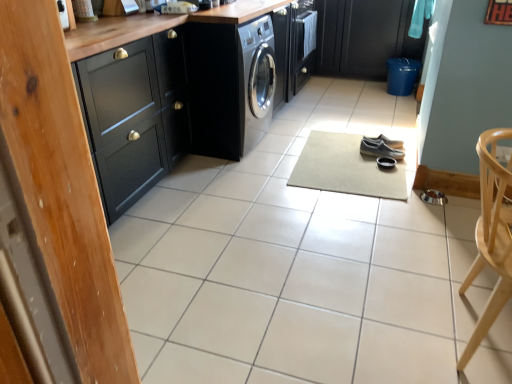
Where is `dark grey canvas shoes at center, the second footwear when ordered from back to front`? The image size is (512, 384). dark grey canvas shoes at center, the second footwear when ordered from back to front is located at coordinates (380, 149).

Measure the distance between dark grey canvas shoes at center, the second footwear when ordered from back to front, and camera.

2.82 meters.

How much space does black matte cabinet at left, which ranks as the 2th cabinetry in top-to-bottom order, occupy vertically?

It is 35.49 inches.

The height and width of the screenshot is (384, 512). What do you see at coordinates (345, 168) in the screenshot?
I see `beige carpet at center` at bounding box center [345, 168].

Locate an element on the screen. black matte cabinet at upper right, which is the 1th cabinetry from right to left is located at coordinates (364, 37).

Considering the relative sizes of black matte cabinet at left, which ranks as the 2th cabinetry in top-to-bottom order, and black leather shoes at center, which is counted as the 2th footwear, starting from the front, in the image provided, is black matte cabinet at left, which ranks as the 2th cabinetry in top-to-bottom order, bigger than black leather shoes at center, which is counted as the 2th footwear, starting from the front,?

Yes, black matte cabinet at left, which ranks as the 2th cabinetry in top-to-bottom order, is bigger than black leather shoes at center, which is counted as the 2th footwear, starting from the front.

From the image's perspective, which one is positioned higher, black matte cabinet at left, positioned as the second cabinetry in right-to-left order, or black leather shoes at center, which is counted as the 2th footwear, starting from the front?

black matte cabinet at left, positioned as the second cabinetry in right-to-left order, is shown above in the image.

Is point (139, 134) farther from viewer compared to point (362, 136)?

No, it is not.

Who is taller, black matte cabinet at left, which is the first cabinetry in bottom-to-top order, or black leather shoes at center, which is counted as the 2th footwear, starting from the front?

black matte cabinet at left, which is the first cabinetry in bottom-to-top order.

Which of these two, dark grey canvas shoes at center, the second footwear when ordered from back to front, or beige carpet at center, stands taller?

With more height is dark grey canvas shoes at center, the second footwear when ordered from back to front.

Is point (398, 152) positioned in front of point (334, 135)?

Yes, point (398, 152) is closer to viewer.

Is dark grey canvas shoes at center, the second footwear when ordered from back to front, wider than beige carpet at center?

In fact, dark grey canvas shoes at center, the second footwear when ordered from back to front, might be narrower than beige carpet at center.

Is dark grey canvas shoes at center, the first footwear positioned from the front, spatially inside beige carpet at center, or outside of it?

dark grey canvas shoes at center, the first footwear positioned from the front, is spatially positioned inside beige carpet at center.

Is the position of satin black washing machine at center more distant than that of black leather shoes at center, which is counted as the 2th footwear, starting from the front?

No, the depth of satin black washing machine at center is less than that of black leather shoes at center, which is counted as the 2th footwear, starting from the front.

Is satin black washing machine at center oriented away from black leather shoes at center, marked as the 1th footwear in a back-to-front arrangement?

No.

Identify the location of washing machine on the left of black leather shoes at center, marked as the 1th footwear in a back-to-front arrangement. (230, 85).

Is satin black washing machine at center shorter than black leather shoes at center, marked as the 1th footwear in a back-to-front arrangement?

No, satin black washing machine at center is not shorter than black leather shoes at center, marked as the 1th footwear in a back-to-front arrangement.

Which is behind, black matte cabinet at upper right, which is counted as the 2th cabinetry, starting from the front, or dark grey canvas shoes at center, the second footwear when ordered from back to front?

black matte cabinet at upper right, which is counted as the 2th cabinetry, starting from the front, is more distant.

Is black matte cabinet at upper right, which is the 1th cabinetry from right to left, inside or outside of dark grey canvas shoes at center, the second footwear when ordered from back to front?

black matte cabinet at upper right, which is the 1th cabinetry from right to left, lies outside dark grey canvas shoes at center, the second footwear when ordered from back to front.

Which is more distant, (357, 0) or (380, 156)?

The point (357, 0) is farther.

Between black matte cabinet at upper right, the first cabinetry in the top-to-bottom sequence, and dark grey canvas shoes at center, the first footwear positioned from the front, which one appears on the left side from the viewer's perspective?

From the viewer's perspective, dark grey canvas shoes at center, the first footwear positioned from the front, appears more on the left side.

Can you confirm if satin black washing machine at center is thinner than black matte cabinet at upper right, the first cabinetry in the top-to-bottom sequence?

In fact, satin black washing machine at center might be wider than black matte cabinet at upper right, the first cabinetry in the top-to-bottom sequence.

Is the surface of satin black washing machine at center in direct contact with black matte cabinet at upper right, the 2th cabinetry in the bottom-to-top sequence?

satin black washing machine at center is not next to black matte cabinet at upper right, the 2th cabinetry in the bottom-to-top sequence, and they're not touching.

Which object is closer to the camera taking this photo, satin black washing machine at center or black matte cabinet at upper right, which is counted as the 2th cabinetry, starting from the front?

Positioned in front is satin black washing machine at center.

What's the angular difference between satin black washing machine at center and black matte cabinet at upper right, the 2th cabinetry in the bottom-to-top sequence,'s facing directions?

They differ by 87.9 degrees in their facing directions.

Are black matte cabinet at left, which appears as the 1th cabinetry when viewed from the left, and beige carpet at center located far from each other?

Yes, black matte cabinet at left, which appears as the 1th cabinetry when viewed from the left, is far from beige carpet at center.

Is black matte cabinet at left, which ranks as the 2th cabinetry in top-to-bottom order, outside of beige carpet at center?

Absolutely, black matte cabinet at left, which ranks as the 2th cabinetry in top-to-bottom order, is external to beige carpet at center.

Identify the location of wide on the right side of black matte cabinet at left, the 1th cabinetry when ordered from front to back. Image resolution: width=512 pixels, height=384 pixels. (345, 168).

Considering the sizes of objects black matte cabinet at left, which ranks as the 2th cabinetry in top-to-bottom order, and beige carpet at center in the image provided, who is wider, black matte cabinet at left, which ranks as the 2th cabinetry in top-to-bottom order, or beige carpet at center?

Wider between the two is beige carpet at center.

Between point (369, 57) and point (398, 143), which one is positioned behind?

The point (369, 57) is more distant.

Can we say black matte cabinet at upper right, the 2th cabinetry in the bottom-to-top sequence, lies outside black leather shoes at center, marked as the 1th footwear in a back-to-front arrangement?

black matte cabinet at upper right, the 2th cabinetry in the bottom-to-top sequence, is positioned outside black leather shoes at center, marked as the 1th footwear in a back-to-front arrangement.

From the image's perspective, is black matte cabinet at upper right, which is the 1th cabinetry from right to left, over black leather shoes at center, marked as the 1th footwear in a back-to-front arrangement?

Yes, from the image's perspective, black matte cabinet at upper right, which is the 1th cabinetry from right to left, is on top of black leather shoes at center, marked as the 1th footwear in a back-to-front arrangement.

Is black matte cabinet at upper right, which is the 1th cabinetry from right to left, looking in the opposite direction of black leather shoes at center, marked as the 1th footwear in a back-to-front arrangement?

No, black matte cabinet at upper right, which is the 1th cabinetry from right to left, is not facing away from black leather shoes at center, marked as the 1th footwear in a back-to-front arrangement.

Locate an element on the screen. the 1st footwear directly beneath the black matte cabinet at left, positioned as the second cabinetry in right-to-left order (from a real-world perspective) is located at coordinates (384, 141).

This screenshot has height=384, width=512. What are the coordinates of `the 1st footwear above when counting from the beige carpet at center (from the image's perspective)` in the screenshot? It's located at (380, 149).

From the image, which object appears to be nearer to black leather shoes at center, marked as the 1th footwear in a back-to-front arrangement, black matte cabinet at left, the second cabinetry positioned from the back, or beige carpet at center?

beige carpet at center is closer to black leather shoes at center, marked as the 1th footwear in a back-to-front arrangement.

Looking at the image, which one is located closer to black matte cabinet at left, which appears as the 1th cabinetry when viewed from the left, dark grey canvas shoes at center, the second footwear when ordered from back to front, or black matte cabinet at upper right, the first cabinetry in the top-to-bottom sequence?

Among the two, dark grey canvas shoes at center, the second footwear when ordered from back to front, is located nearer to black matte cabinet at left, which appears as the 1th cabinetry when viewed from the left.

Based on their spatial positions, is satin black washing machine at center or beige carpet at center further from black matte cabinet at upper right, the 2th cabinetry in the bottom-to-top sequence?

satin black washing machine at center is further to black matte cabinet at upper right, the 2th cabinetry in the bottom-to-top sequence.

Based on their spatial positions, is beige carpet at center or dark grey canvas shoes at center, the first footwear positioned from the front, further from black matte cabinet at left, which appears as the 1th cabinetry when viewed from the left?

dark grey canvas shoes at center, the first footwear positioned from the front, lies further to black matte cabinet at left, which appears as the 1th cabinetry when viewed from the left, than the other object.

When comparing their distances from beige carpet at center, does black matte cabinet at left, positioned as the second cabinetry in right-to-left order, or black leather shoes at center, which is counted as the 2th footwear, starting from the front, seem closer?

black leather shoes at center, which is counted as the 2th footwear, starting from the front, lies closer to beige carpet at center than the other object.

When comparing their distances from dark grey canvas shoes at center, the first footwear positioned from the front, does black matte cabinet at left, positioned as the second cabinetry in right-to-left order, or beige carpet at center seem closer?

beige carpet at center lies closer to dark grey canvas shoes at center, the first footwear positioned from the front, than the other object.

Estimate the real-world distances between objects in this image. Which object is closer to dark grey canvas shoes at center, the first footwear positioned from the front, satin black washing machine at center or black matte cabinet at upper right, marked as the first cabinetry in a back-to-front arrangement?

satin black washing machine at center is positioned closer to the anchor dark grey canvas shoes at center, the first footwear positioned from the front.

From the picture: Considering their positions, is satin black washing machine at center positioned closer to black matte cabinet at left, positioned as the second cabinetry in right-to-left order, than black matte cabinet at upper right, the 2th cabinetry in the bottom-to-top sequence?

The object closer to black matte cabinet at left, positioned as the second cabinetry in right-to-left order, is satin black washing machine at center.

Where is `washing machine located between black matte cabinet at left, which ranks as the 2th cabinetry in top-to-bottom order, and black leather shoes at center, marked as the 1th footwear in a back-to-front arrangement, in the left-right direction`? washing machine located between black matte cabinet at left, which ranks as the 2th cabinetry in top-to-bottom order, and black leather shoes at center, marked as the 1th footwear in a back-to-front arrangement, in the left-right direction is located at coordinates (230, 85).

At what (x,y) coordinates should I click in order to perform the action: click on wide located between satin black washing machine at center and dark grey canvas shoes at center, the first footwear positioned from the front, in the left-right direction. Please return your answer as a coordinate pair (x, y). The height and width of the screenshot is (384, 512). Looking at the image, I should click on (345, 168).

Find the location of `footwear situated between satin black washing machine at center and black leather shoes at center, which is counted as the 2th footwear, starting from the front, from left to right`. footwear situated between satin black washing machine at center and black leather shoes at center, which is counted as the 2th footwear, starting from the front, from left to right is located at coordinates (380, 149).

The width and height of the screenshot is (512, 384). What are the coordinates of `wide between black matte cabinet at left, positioned as the second cabinetry in right-to-left order, and dark grey canvas shoes at center, the second footwear when ordered from back to front, from left to right` in the screenshot? It's located at (345, 168).